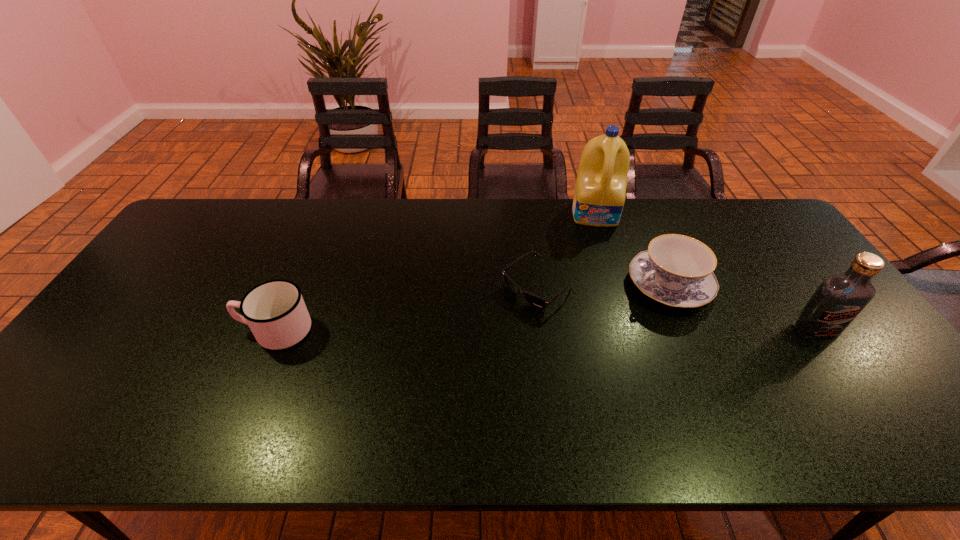
Identify the location of unoccupied area between the fourth shortest object and the shortest object. This screenshot has height=540, width=960. (677, 308).

This screenshot has height=540, width=960. Find the location of `free space between the chinaware and the tallest object`. free space between the chinaware and the tallest object is located at coordinates (633, 249).

Where is `empty location between the tallest object and the chinaware`? empty location between the tallest object and the chinaware is located at coordinates (633, 249).

This screenshot has width=960, height=540. In order to click on free space between the second tallest object and the sunglasses in this screenshot , I will do `click(677, 308)`.

At what (x,y) coordinates should I click in order to perform the action: click on unoccupied position between the leftmost object and the sunglasses. Please return your answer as a coordinate pair (x, y). The height and width of the screenshot is (540, 960). Looking at the image, I should click on (407, 308).

This screenshot has height=540, width=960. In order to click on vacant area between the chinaware and the farthest object in this screenshot , I will do `click(633, 249)`.

Image resolution: width=960 pixels, height=540 pixels. Identify the location of vacant area that lies between the chinaware and the shortest object. (604, 286).

The width and height of the screenshot is (960, 540). What are the coordinates of `object that stands as the third closest to the vodka` in the screenshot? It's located at pos(540,303).

Select which object appears as the fourth closest to the detergent. Please provide its 2D coordinates. Your answer should be formatted as a tuple, i.e. [(x, y)], where the tuple contains the x and y coordinates of a point satisfying the conditions above.

[(275, 311)]

Image resolution: width=960 pixels, height=540 pixels. Find the location of `vacant region that satisfies the following two spatial constraints: 1. on the back side of the tallest object; 2. on the left side of the shortest object`. vacant region that satisfies the following two spatial constraints: 1. on the back side of the tallest object; 2. on the left side of the shortest object is located at coordinates (529, 213).